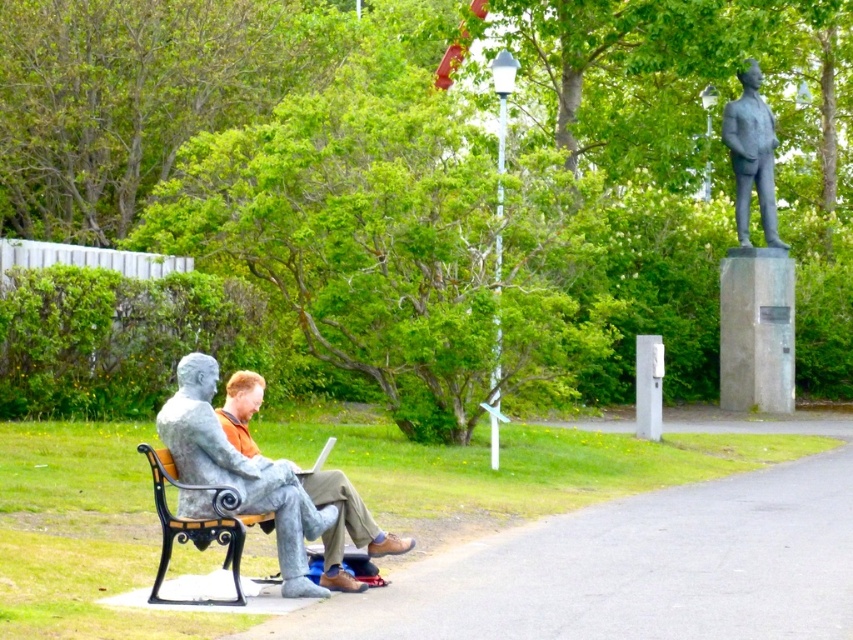
You are planning to place a new flower pot between the smooth stone bench at lower left and the polished bronze statue at upper right. Considering their heights, which object should the flower pot be placed closer to in order to avoid blocking the view of the taller one?

The polished bronze statue at upper right is taller than the smooth stone bench at lower left. To avoid blocking its view, the flower pot should be placed closer to the smooth stone bench at lower left.